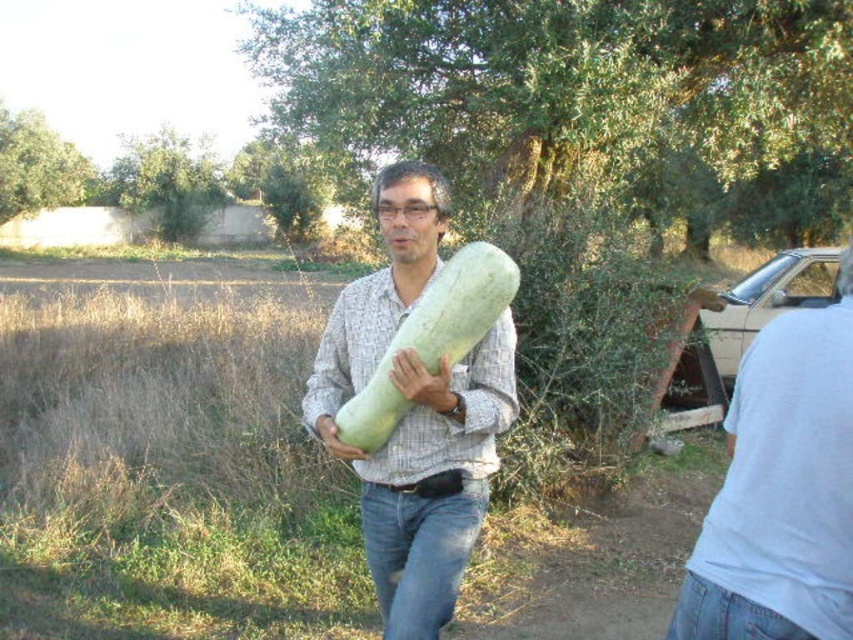
You are a photographer trying to capture the smooth yellow squash at center and the white matte shirt at right in your shot. Which object should you adjust your camera to focus on first if you want to include both in the frame?

The white matte shirt at right is positioned on the right side of smooth yellow squash at center, so you should focus on the smooth yellow squash at center first as it is closer to the center of the frame.

You are a photographer trying to capture the man in the white matte shirt at right. Based on the scene, where should you position your camera to ensure the shirt is in the frame?

The white matte shirt at right is located at point (781, 490), so position the camera to include that coordinate in the frame.